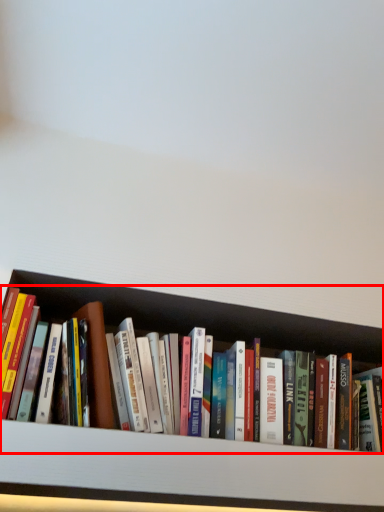
Question: Observing the image, what is the correct spatial positioning of book (annotated by the red box) in reference to cabinet?

Choices:
 (A) left
 (B) right

Answer: (A)